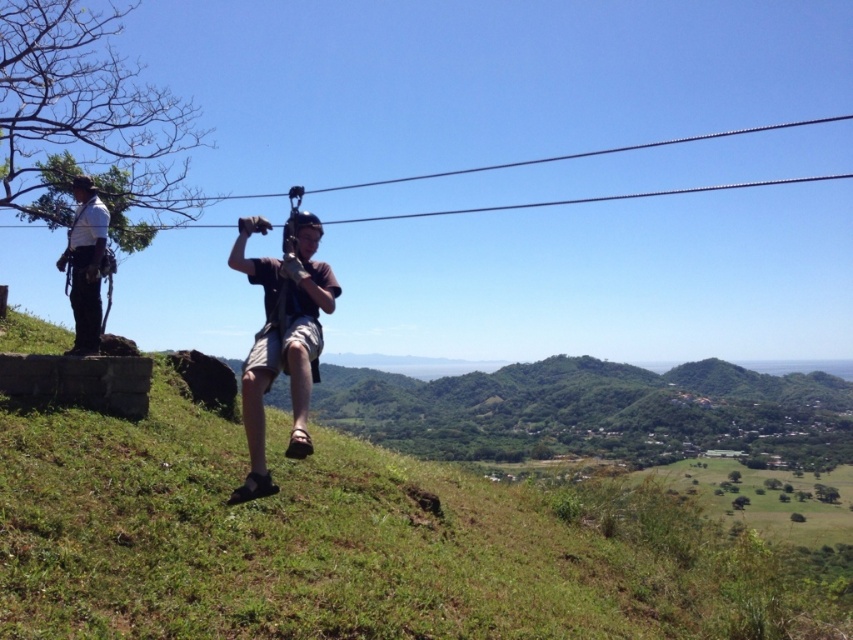
Looking at this image, you are a photographer trying to capture the zipline participant. You notice the brown fabric shorts at center and the white shirt with harness at left. Which object should you focus on if you want to photograph the subject closer to the right side of the image?

The brown fabric shorts at center is to the right of white shirt with harness at left, so you should focus on the brown fabric shorts at center to capture the subject closer to the right side of the image.